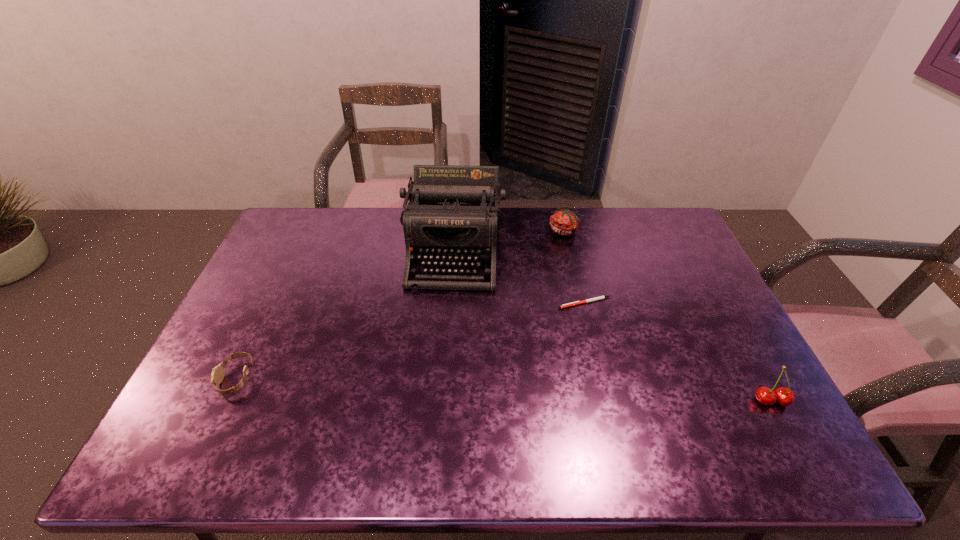
Locate an element on the screen. The height and width of the screenshot is (540, 960). watch that is positioned at the near edge is located at coordinates coord(217,375).

Where is `cherry present at the near edge`? The height and width of the screenshot is (540, 960). cherry present at the near edge is located at coordinates [785, 397].

This screenshot has height=540, width=960. Identify the location of object located in the left edge section of the desktop. (217, 375).

Identify the location of object that is positioned at the right edge. The height and width of the screenshot is (540, 960). (785, 397).

At what (x,y) coordinates should I click in order to perform the action: click on object that is at the near left corner. Please return your answer as a coordinate pair (x, y). This screenshot has width=960, height=540. Looking at the image, I should click on (217, 375).

Where is `object situated at the near right corner`? The width and height of the screenshot is (960, 540). object situated at the near right corner is located at coordinates (785, 397).

Where is `vacant region at the far edge of the desktop`? vacant region at the far edge of the desktop is located at coordinates (325, 244).

Locate an element on the screen. This screenshot has height=540, width=960. vacant space at the near edge of the desktop is located at coordinates (663, 400).

The height and width of the screenshot is (540, 960). I want to click on blank space at the left edge, so click(272, 253).

Locate an element on the screen. vacant area at the right edge of the desktop is located at coordinates point(687,339).